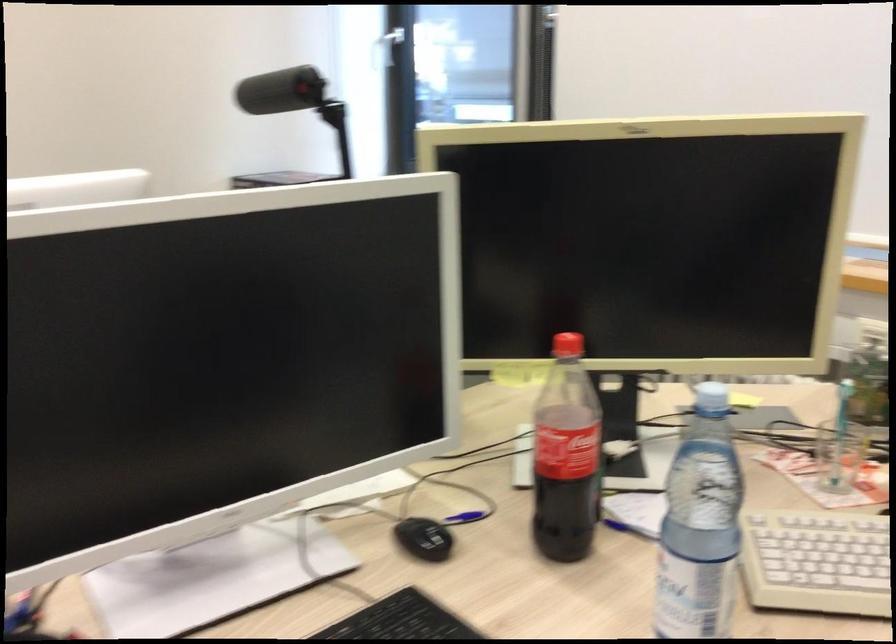
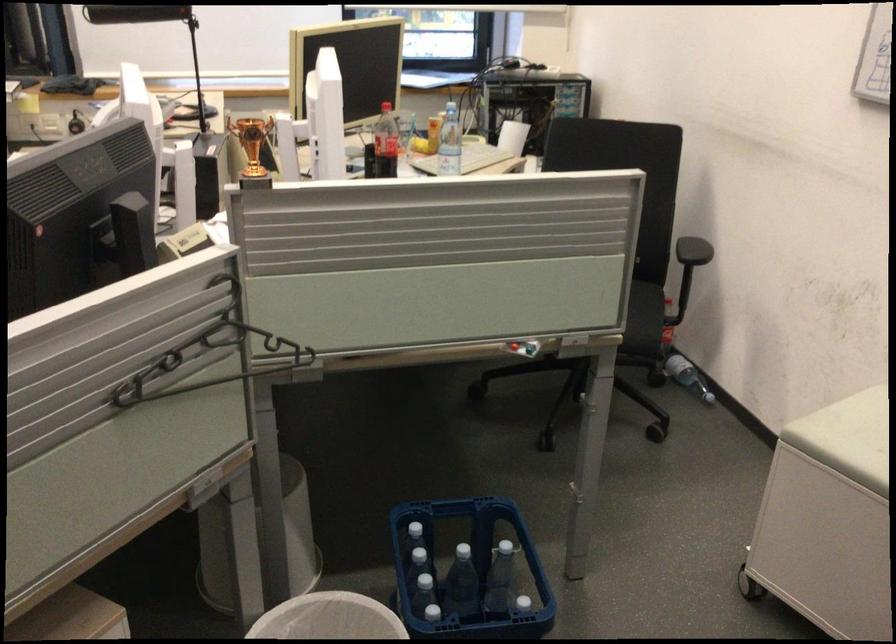
Question: I am providing you with two images of the same scene from different viewpoints. After the viewpoint changes to image2, which objects are now occluded?

Choices:
 (A) black keyboard
 (B) black duffel bag
 (C) chair sitting surface
 (D) black chair armrest

Answer: (A)